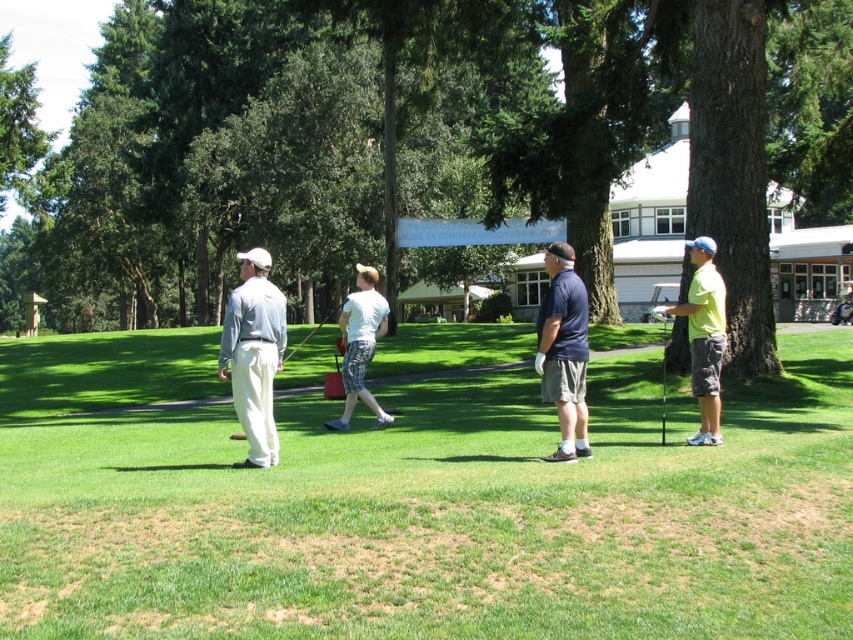
The width and height of the screenshot is (853, 640). Describe the element at coordinates (444, 516) in the screenshot. I see `green grass at center` at that location.

Can you confirm if green grass at center is bigger than light gray cotton pants at left?

Correct, green grass at center is larger in size than light gray cotton pants at left.

This screenshot has height=640, width=853. In order to click on green grass at center in this screenshot , I will do `click(444, 516)`.

The width and height of the screenshot is (853, 640). Find the location of `green grass at center`. green grass at center is located at coordinates (444, 516).

Between point (154, 435) and point (569, 244), which one is positioned behind?

The point (569, 244) is more distant.

Is green grass at center above dark blue shirt at center?

No.

Identify the location of green grass at center. The width and height of the screenshot is (853, 640). (444, 516).

Who is positioned more to the left, light gray cotton pants at left or dark blue shirt at center?

Positioned to the left is light gray cotton pants at left.

Who is more forward, (280, 355) or (560, 385)?

Point (560, 385)

This screenshot has width=853, height=640. Find the location of `light gray cotton pants at left`. light gray cotton pants at left is located at coordinates pos(254,355).